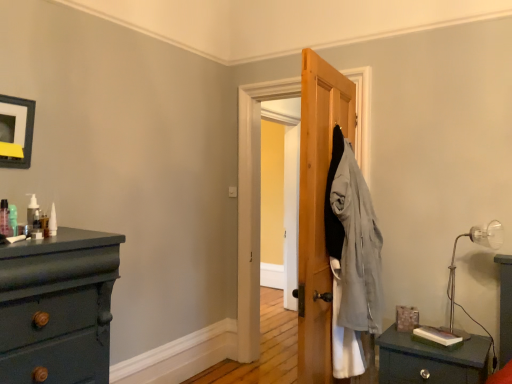
Question: From a real-world perspective, is white matte bottle at upper left, arranged as the first toiletry when viewed from the right, physically located above or below matte black picture frame at upper left?

Choices:
 (A) above
 (B) below

Answer: (B)

Question: From the image's perspective, is white matte bottle at upper left, placed as the third toiletry when sorted from front to back, above or below matte black picture frame at upper left?

Choices:
 (A) below
 (B) above

Answer: (A)

Question: Based on their relative distances, which object is farther from the translucent plastic pump at left, acting as the second toiletry starting from the back?

Choices:
 (A) metallic silver table lamp at right
 (B) matte black nightstand at lower right
 (C) translucent plastic pump at left, which ranks as the first toiletry in left-to-right order
 (D) matte black picture frame at upper left
 (E) white matte bottle at upper left, acting as the 1th toiletry starting from the back

Answer: (A)

Question: Estimate the real-world distances between objects in this image. Which object is closer to the white matte bottle at upper left, placed as the third toiletry when sorted from front to back?

Choices:
 (A) translucent plastic pump at left, which ranks as the first toiletry in front-to-back order
 (B) matte black nightstand at lower right
 (C) translucent plastic pump at left, acting as the second toiletry starting from the back
 (D) matte black picture frame at upper left
 (E) metallic silver table lamp at right

Answer: (C)